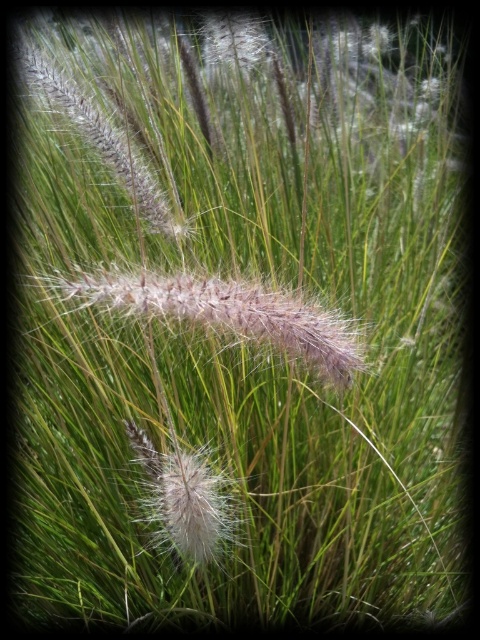
Question: Does fuzzy brown grass at center appear under white fluffy flower at upper center?

Choices:
 (A) yes
 (B) no

Answer: (A)

Question: Among these objects, which one is farthest from the camera?

Choices:
 (A) fuzzy brown grass at center
 (B) white fluffy flower at upper center

Answer: (B)

Question: Which point appears farthest from the camera in this image?

Choices:
 (A) (275, 298)
 (B) (262, 54)
 (C) (178, 529)

Answer: (B)

Question: Is fuzzy white flower at center positioned before white fluffy flower at upper center?

Choices:
 (A) no
 (B) yes

Answer: (B)

Question: Considering the real-world distances, which object is farthest from the fuzzy brown grass at center?

Choices:
 (A) white fluffy flower at upper center
 (B) fuzzy white flower at center

Answer: (A)

Question: Considering the relative positions of fuzzy brown grass at center and white fluffy flower at upper center in the image provided, where is fuzzy brown grass at center located with respect to white fluffy flower at upper center?

Choices:
 (A) above
 (B) below

Answer: (B)